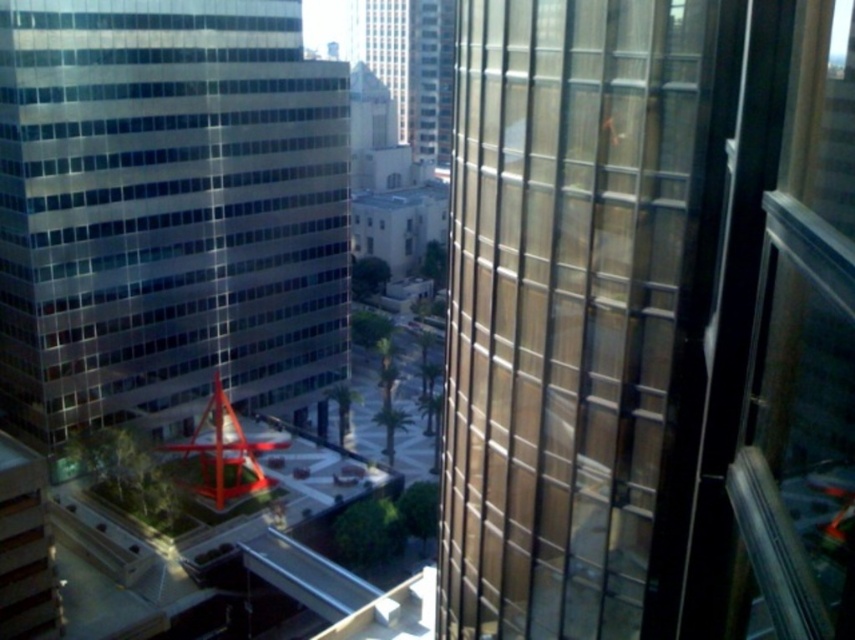
Question: Can you confirm if transparent glass building at left is thinner than glassy reflective skyscraper at center?

Choices:
 (A) yes
 (B) no

Answer: (B)

Question: Which point is farther to the camera?

Choices:
 (A) (414, 3)
 (B) (93, 237)

Answer: (A)

Question: Which point is closer to the camera taking this photo?

Choices:
 (A) (143, 160)
 (B) (426, 90)

Answer: (A)

Question: Does transparent glass building at left have a lesser width compared to glassy reflective skyscraper at center?

Choices:
 (A) yes
 (B) no

Answer: (B)

Question: Is transparent glass building at left thinner than glassy reflective skyscraper at center?

Choices:
 (A) yes
 (B) no

Answer: (B)